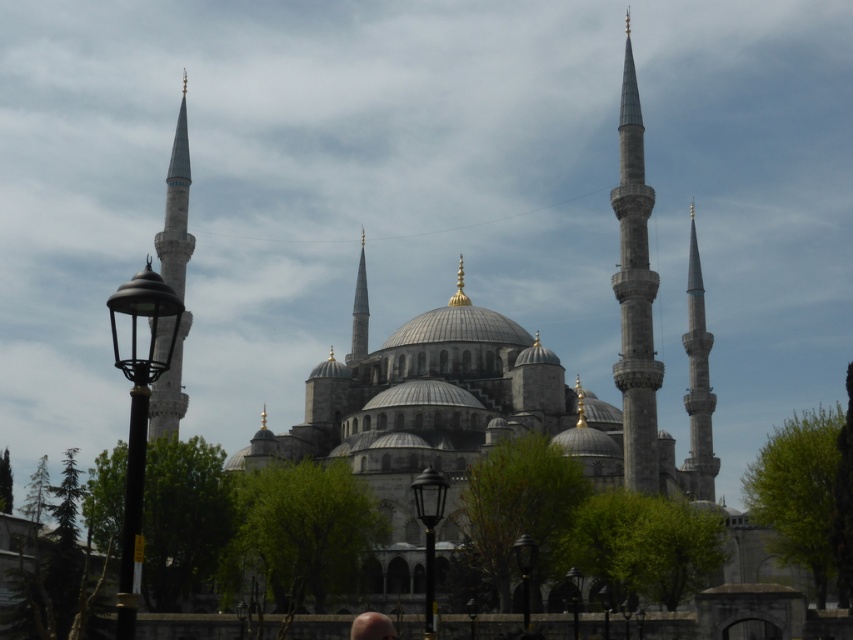
Between smooth stone minaret at center and smooth skin head at lower center, which one is positioned higher?

smooth stone minaret at center

Is the position of smooth stone minaret at center less distant than that of smooth skin head at lower center?

No, smooth stone minaret at center is behind smooth skin head at lower center.

Does point (357, 324) come behind point (350, 632)?

That is True.

The image size is (853, 640). What are the coordinates of `smooth stone minaret at center` in the screenshot? It's located at (358, 310).

Who is higher up, gray stone minaret at center-right or gray stone spire at right?

gray stone minaret at center-right is higher up.

Does gray stone minaret at center-right lie behind gray stone spire at right?

No, it is not.

Who is more forward, (654, 388) or (715, 460)?

Point (654, 388) is more forward.

Where is `gray stone minaret at center-right`? This screenshot has width=853, height=640. gray stone minaret at center-right is located at coordinates (635, 294).

Does gray stone spire at right appear over smooth skin head at lower center?

Indeed, gray stone spire at right is positioned over smooth skin head at lower center.

Who is higher up, gray stone spire at right or smooth skin head at lower center?

gray stone spire at right

At what (x,y) coordinates should I click in order to perform the action: click on gray stone spire at right. Please return your answer as a coordinate pair (x, y). This screenshot has height=640, width=853. Looking at the image, I should click on (698, 381).